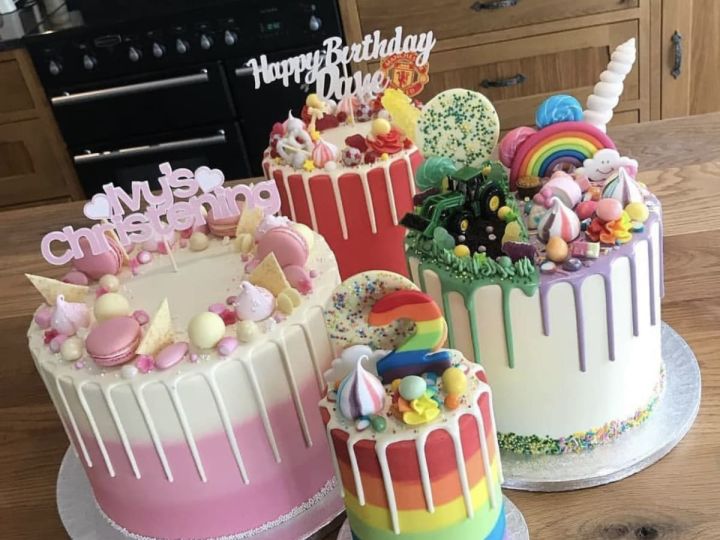
This screenshot has width=720, height=540. What are the coordinates of `wooden table` in the screenshot? It's located at (701, 195), (675, 154), (684, 270).